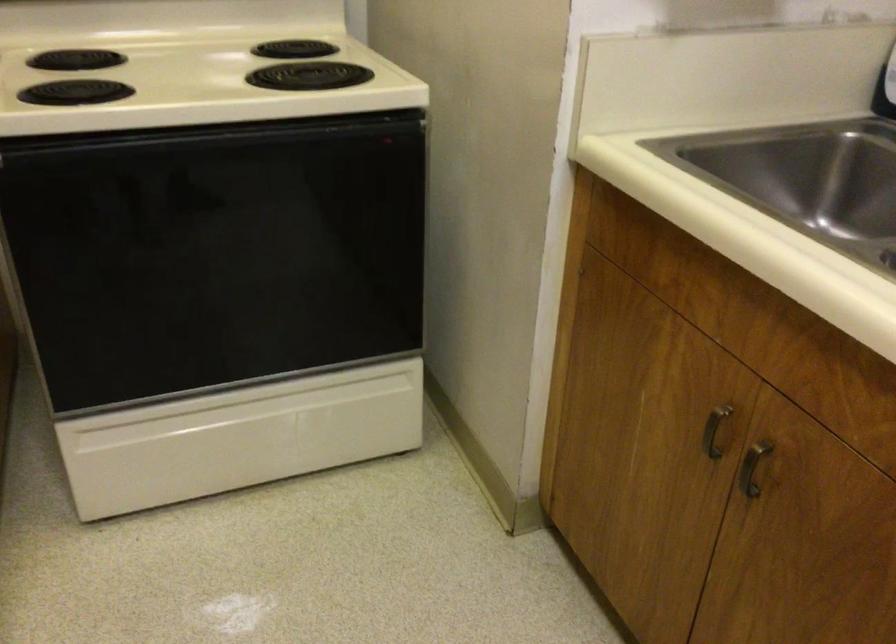
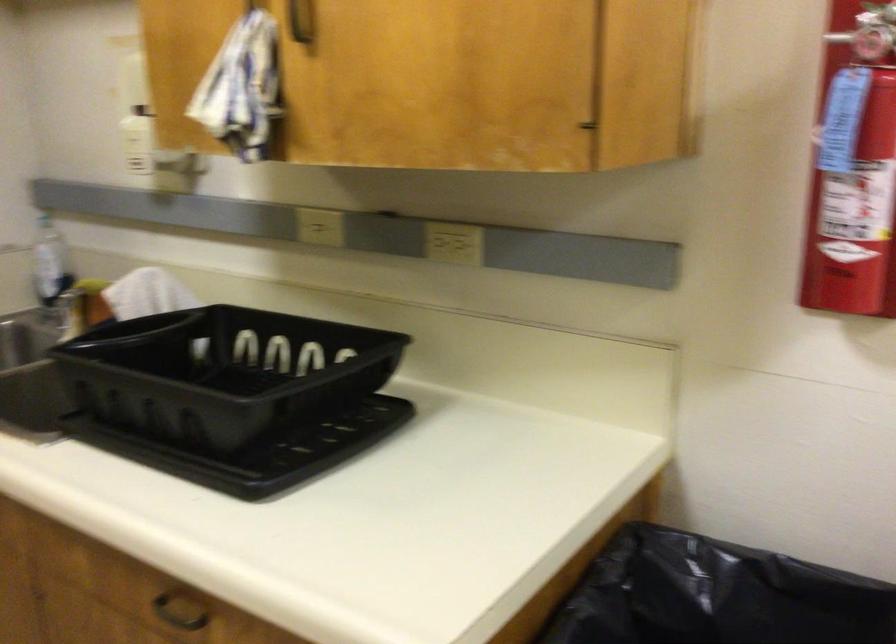
Question: The camera is either moving clockwise (left) or counter-clockwise (right) around the object. The first image is from the beginning of the video and the second image is from the end. Is the camera moving left or right when shooting the video?

Choices:
 (A) Left
 (B) Right

Answer: (A)